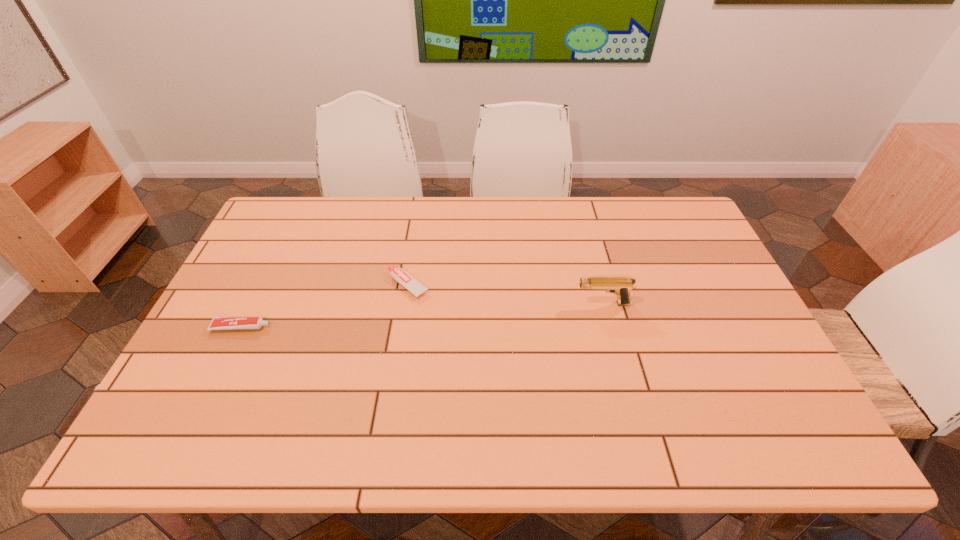
Identify the location of vacant point located between the farther toothpaste and the leftmost object. (324, 306).

Locate an element on the screen. The image size is (960, 540). empty location between the pistol and the second object from right to left is located at coordinates (505, 294).

Where is `unoccupied area between the tallest object and the left toothpaste`? This screenshot has height=540, width=960. unoccupied area between the tallest object and the left toothpaste is located at coordinates (422, 315).

In order to click on free space between the tallest object and the nearest object in this screenshot , I will do `click(422, 315)`.

You are a GUI agent. You are given a task and a screenshot of the screen. Output one action in this format:
    pyautogui.click(x=<x>, y=<y>)
    Task: Click on the vacant point located between the nearer toothpaste and the farther toothpaste
    Image resolution: width=960 pixels, height=540 pixels.
    Given the screenshot: What is the action you would take?
    pyautogui.click(x=324, y=306)

I want to click on vacant point located between the tallest object and the second object from left to right, so click(x=505, y=294).

The height and width of the screenshot is (540, 960). Find the location of `empty space between the pistol and the second object from left to right`. empty space between the pistol and the second object from left to right is located at coordinates (505, 294).

Find the location of a particular element. Image resolution: width=960 pixels, height=540 pixels. free spot between the tallest object and the farther toothpaste is located at coordinates (505, 294).

Identify which object is located as the nearest to the farther toothpaste. Please provide its 2D coordinates. Your answer should be formatted as a tuple, i.e. [(x, y)], where the tuple contains the x and y coordinates of a point satisfying the conditions above.

[(218, 323)]

Locate an element on the screen. The image size is (960, 540). object that is the second closest to the nearer toothpaste is located at coordinates (620, 286).